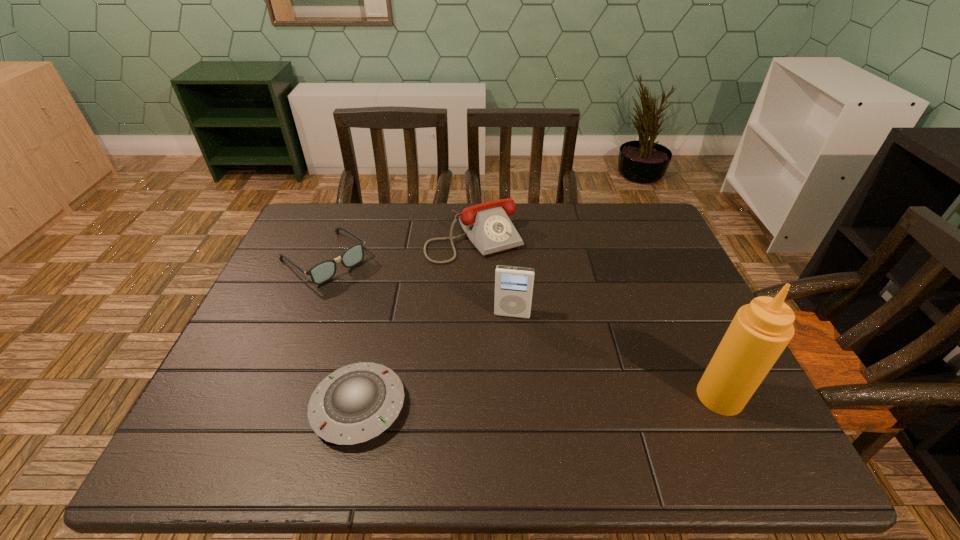
What are the coordinates of `vacant space in between the tallest object and the third shortest object` in the screenshot? It's located at (597, 316).

You are a GUI agent. You are given a task and a screenshot of the screen. Output one action in this format:
    pyautogui.click(x=<x>, y=<y>)
    Task: Click on the vacant space that is in between the shortest object and the second shortest object
    
    Given the screenshot: What is the action you would take?
    pyautogui.click(x=342, y=333)

Image resolution: width=960 pixels, height=540 pixels. Identify the location of vacant area that lies between the condiment and the shortest object. (540, 402).

This screenshot has width=960, height=540. I want to click on the closest object to the shortest object, so click(513, 285).

Where is `object that is the third closest to the saucer`? The image size is (960, 540). object that is the third closest to the saucer is located at coordinates (487, 225).

This screenshot has width=960, height=540. Identify the location of vacant space that satisfies the following two spatial constraints: 1. on the back side of the shortest object; 2. on the left side of the third tallest object. (397, 237).

Where is `free space that satisfies the following two spatial constraints: 1. on the front side of the saucer; 2. on the left side of the second shortest object`? Image resolution: width=960 pixels, height=540 pixels. free space that satisfies the following two spatial constraints: 1. on the front side of the saucer; 2. on the left side of the second shortest object is located at coordinates (263, 407).

This screenshot has height=540, width=960. Identify the location of vacant area in the image that satisfies the following two spatial constraints: 1. on the front side of the condiment; 2. on the right side of the third nearest object. (518, 396).

Identify the location of vacant space that satisfies the following two spatial constraints: 1. on the front side of the spectacles; 2. on the left side of the saucer. (263, 407).

In order to click on free space that satisfies the following two spatial constraints: 1. on the back side of the saucer; 2. on the left side of the tallest object in this screenshot , I will do `click(361, 396)`.